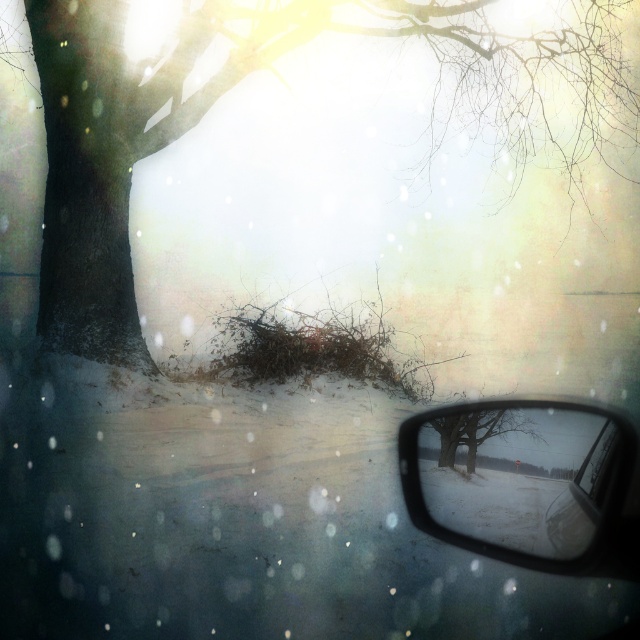
You are sitting in the driver seat of the car and looking out through the windshield. There is a point marked at coordinates (280, 77) on your windshield. What object does this point correspond to in the winter scene outside?

The point at coordinates (280, 77) corresponds to the brown textured tree at upper left.

You are driving in a snowy area and need to check your blind spot. You see the brown textured tree at upper left and the clear plastic side mirror at lower right. Which object is positioned higher in the vehicle window?

The brown textured tree at upper left is above the clear plastic side mirror at lower right, so the brown textured tree at upper left is positioned higher in the vehicle window.

Based on the photo, you are driving a car and want to know if you can safely pass through the gap between the two points marked as point (170, 93). Can your car, which is 6 feet wide, fit through the gap?

The gap between the two points marked as point (170, 93) is 28.08 feet wide, which is wider than your car, so yes, you can safely pass through the gap.